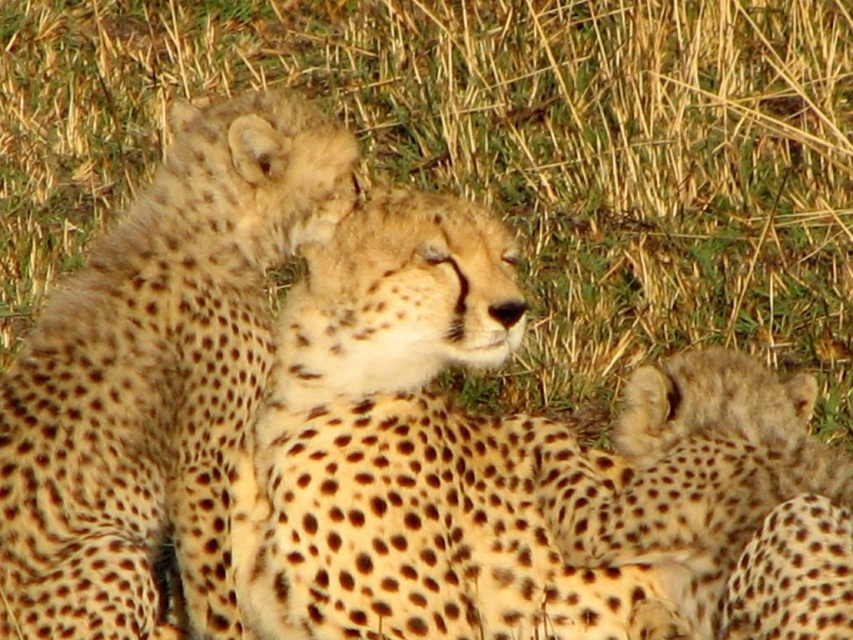
Between spotted fur cheetah cub at upper center and spotted fur cheetah cub at lower right, which one is positioned higher?

A: spotted fur cheetah cub at upper center is above.

Between spotted fur cheetah cub at upper center and spotted fur cheetah cub at lower right, which one has less height?

spotted fur cheetah cub at lower right

Between point (155, 339) and point (728, 380), which one is positioned behind?

Point (155, 339)

At what (x,y) coordinates should I click in order to perform the action: click on spotted fur cheetah cub at upper center. Please return your answer as a coordinate pair (x, y). The height and width of the screenshot is (640, 853). Looking at the image, I should click on (157, 376).

Who is lower down, yellowish grass at center or spotted fur cheetah at center?

spotted fur cheetah at center is below.

Is yellowish grass at center bigger than spotted fur cheetah at center?

Indeed, yellowish grass at center has a larger size compared to spotted fur cheetah at center.

Where is `yellowish grass at center`? The image size is (853, 640). yellowish grass at center is located at coordinates (496, 157).

The image size is (853, 640). In order to click on yellowish grass at center in this screenshot , I will do `click(496, 157)`.

In the scene shown: Between spotted fur cheetah at center and spotted fur cheetah cub at lower right, which one appears on the left side from the viewer's perspective?

spotted fur cheetah at center

Can you confirm if spotted fur cheetah at center is taller than spotted fur cheetah cub at lower right?

Correct, spotted fur cheetah at center is much taller as spotted fur cheetah cub at lower right.

Locate an element on the screen. The height and width of the screenshot is (640, 853). spotted fur cheetah at center is located at coordinates (410, 454).